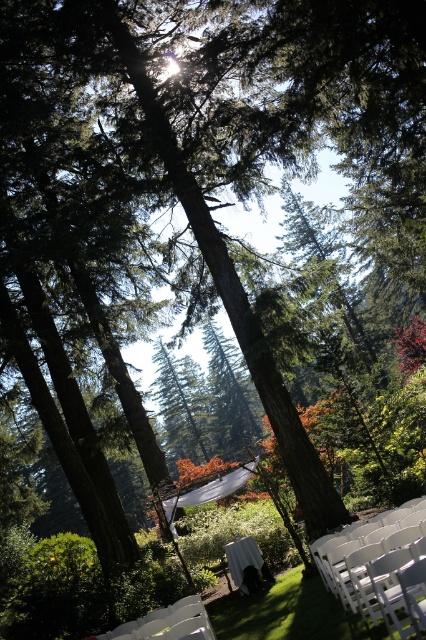
You are a guest arriving at the wedding venue and need to choose between the white plastic chair at lower right and the white plastic chair at lower center. Which chair is taller?

The white plastic chair at lower right is taller than the white plastic chair at lower center.

In the scene shown: You are standing at the center of the scene and want to move towards the white plastic chair at lower right. Which direction should you walk to reach it?

You should walk towards the lower right direction to reach the white plastic chair at lower right since it is located at point (x=359, y=548).